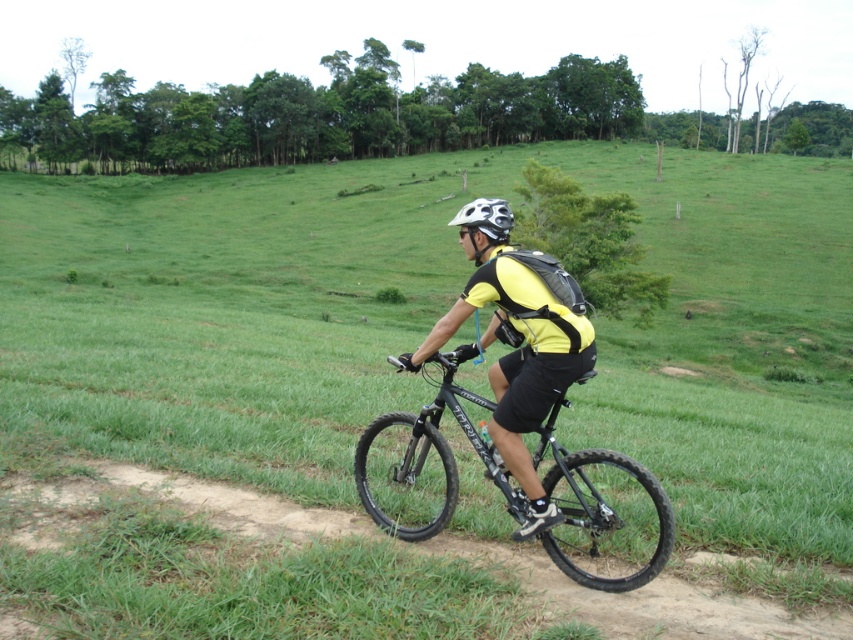
Question: Which point is farther to the camera?

Choices:
 (A) (566, 372)
 (B) (450, 392)

Answer: (B)

Question: Does black matte bicycle at center have a smaller size compared to matte black bicycle at center?

Choices:
 (A) yes
 (B) no

Answer: (B)

Question: Among these objects, which one is farthest from the camera?

Choices:
 (A) matte black bicycle at center
 (B) black matte bicycle at center

Answer: (A)

Question: Is black matte bicycle at center wider than matte black bicycle at center?

Choices:
 (A) yes
 (B) no

Answer: (A)

Question: Does black matte bicycle at center appear on the left side of matte black bicycle at center?

Choices:
 (A) no
 (B) yes

Answer: (A)